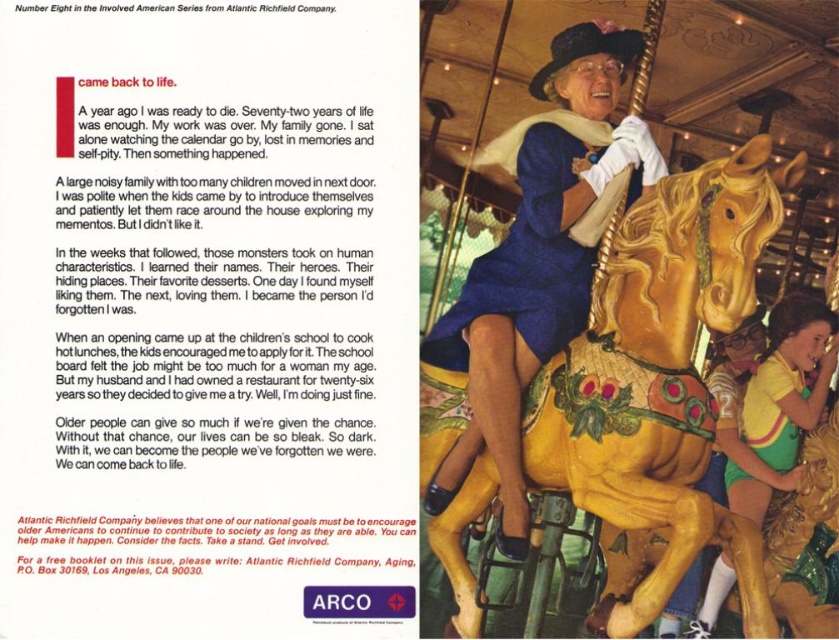
What is the exact location of the blue satin dress at center in the image?

The blue satin dress at center is located at point (x=537, y=262).